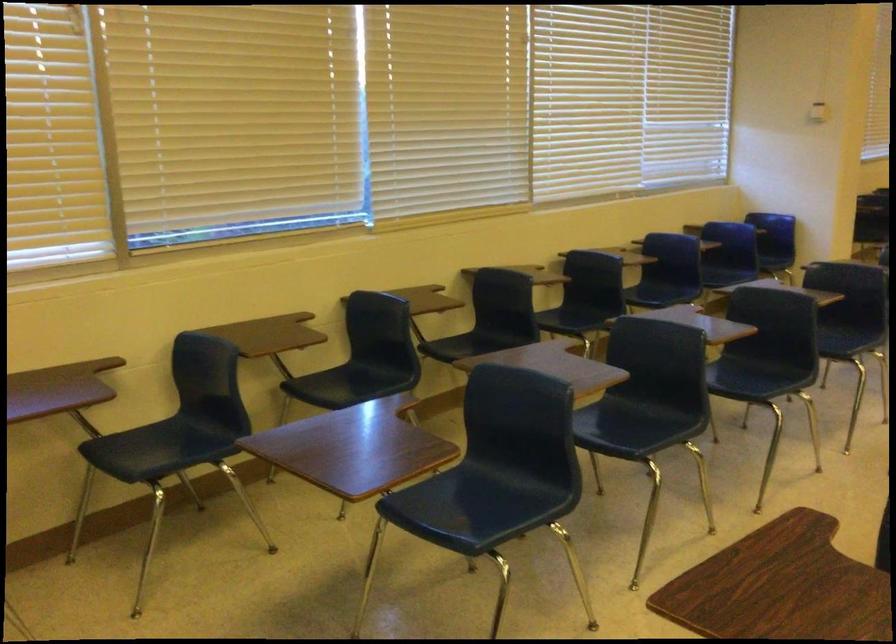
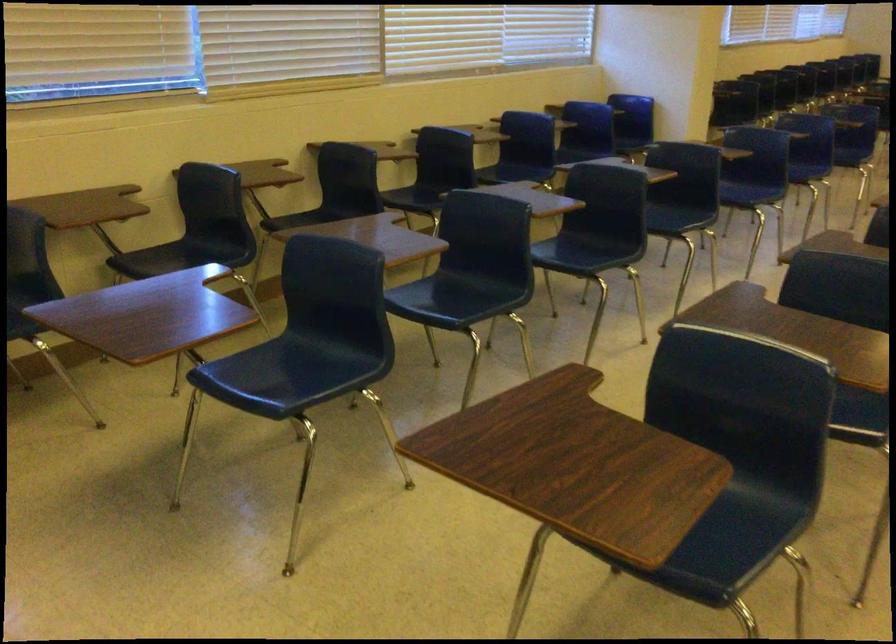
Find the pixel in the second image that matches pixel 464 500 in the first image.

(283, 375)